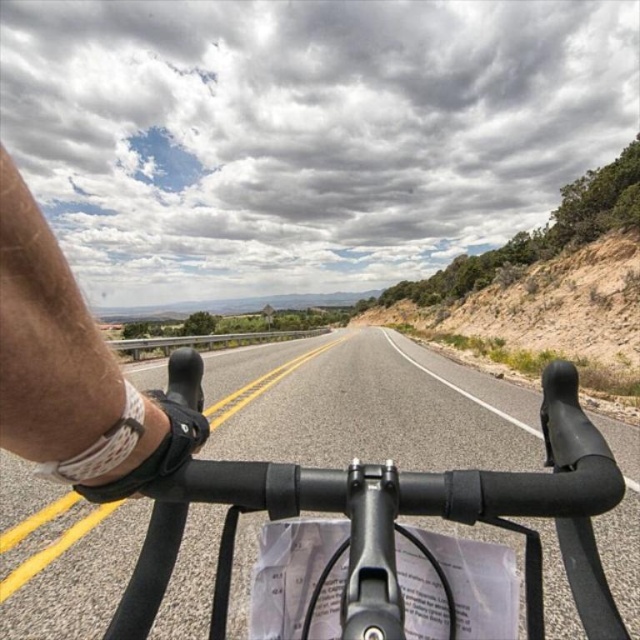
You are riding a bicycle and want to check the GPS mounted on your handlebars. However, there is a skinny white bandage in your view. Which object is closer to you, the black matte bicycle handlebars at center or the skinny white bandage at left?

The black matte bicycle handlebars at center is located below the skinny white bandage at left, meaning the skinny white bandage at left is closer to you.

You are riding a bicycle and want to check your GPS mounted on the black matte bicycle handlebars at center. However, you notice a skinny white bandage at left on your arm. Which object is larger in size?

The black matte bicycle handlebars at center is bigger than the skinny white bandage at left.

You are a cyclist checking your bike setup. You have a black matte bicycle handlebars at center and a skinny white bandage at left. Which object is wider?

The black matte bicycle handlebars at center is wider than the skinny white bandage at left.